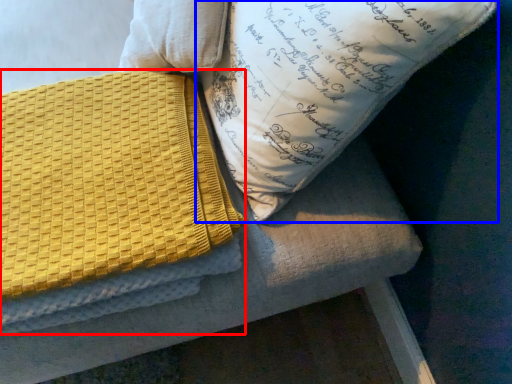
Question: Which point is further to the camera, blanket (highlighted by a red box) or pillow (highlighted by a blue box)?

Choices:
 (A) blanket
 (B) pillow

Answer: (A)